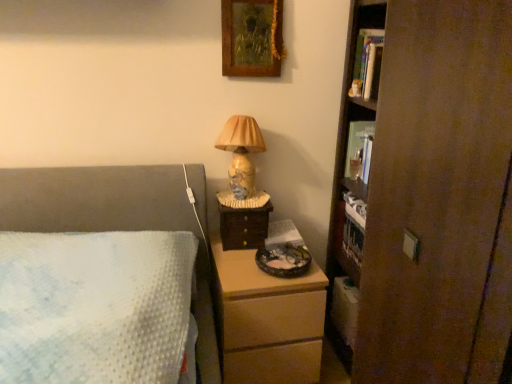
Identify the location of vacant region below matte ceramic lamp at center (from a real-world perspective). (239, 198).